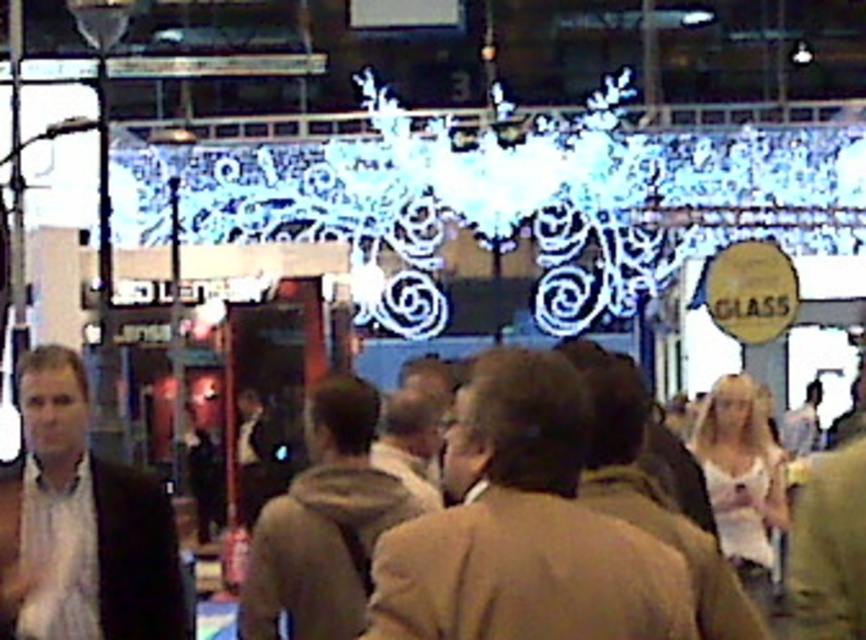
You are standing at the entrance of the exhibition hall and see two points marked in the image. The first point is at coordinate point [86,524] and the second is at point [281,496]. Which point is closer to you?

Point [86,524] is closer to you because it is in front of point [281,496].

You are at the event and want to approach the brown fuzzy jacket at center. Which direction should you move to get closer to it from the white shirt at left?

Since the white shirt at left is closer to the viewer than the brown fuzzy jacket at center, you should move forward towards the brown fuzzy jacket at center to get closer to it.